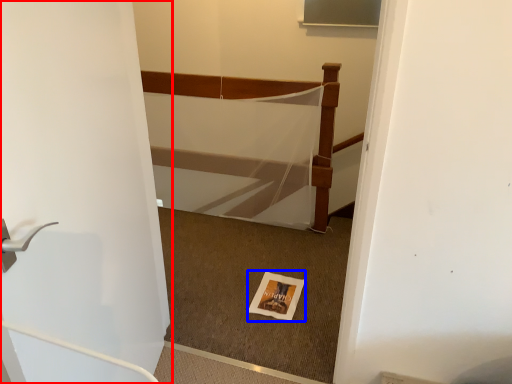
Question: Which object appears farthest to the camera in this image, door (highlighted by a red box) or postcard (highlighted by a blue box)?

Choices:
 (A) door
 (B) postcard

Answer: (B)